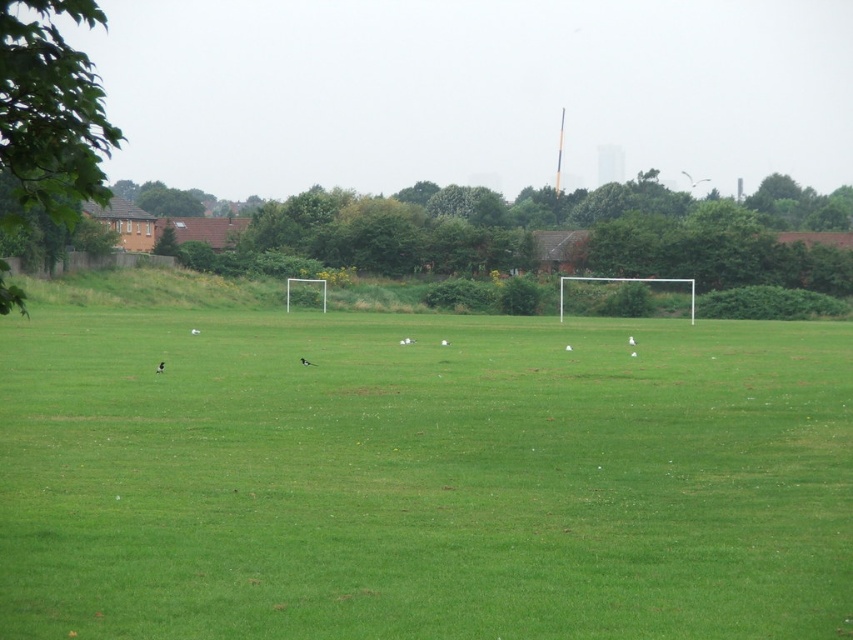
Is green leafy tree at center behind green leafy tree at left?

Yes.

Who is positioned more to the left, green leafy tree at center or green leafy tree at left?

green leafy tree at left

Does point (260, 205) come behind point (6, 154)?

Yes, point (260, 205) is behind point (6, 154).

Find the location of a particular element. The height and width of the screenshot is (640, 853). green leafy tree at center is located at coordinates (550, 234).

Between point (440, 580) and point (39, 147), which one is positioned behind?

The point (440, 580) is more distant.

Who is shorter, green grass field at center or green leafy tree at left?

green grass field at center

What do you see at coordinates (422, 480) in the screenshot? I see `green grass field at center` at bounding box center [422, 480].

The height and width of the screenshot is (640, 853). I want to click on green grass field at center, so click(422, 480).

Which is below, green grass field at center or green leafy tree at center?

green grass field at center

Who is positioned more to the left, green grass field at center or green leafy tree at center?

Positioned to the left is green grass field at center.

Is point (846, 474) in front of point (361, 253)?

Yes, it is.

You are a GUI agent. You are given a task and a screenshot of the screen. Output one action in this format:
    pyautogui.click(x=<x>, y=<y>)
    Task: Click on the green grass field at center
    This screenshot has width=853, height=640.
    Given the screenshot: What is the action you would take?
    pyautogui.click(x=422, y=480)